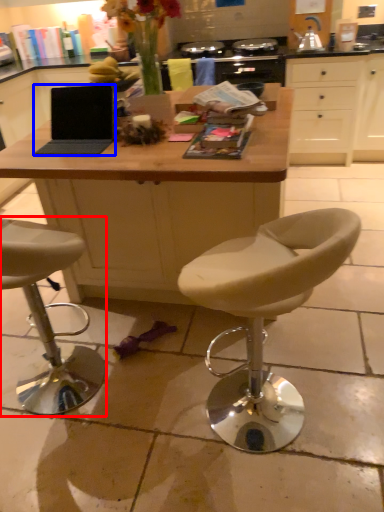
Question: Which object appears farthest to the camera in this image, chair (highlighted by a red box) or laptop (highlighted by a blue box)?

Choices:
 (A) chair
 (B) laptop

Answer: (B)